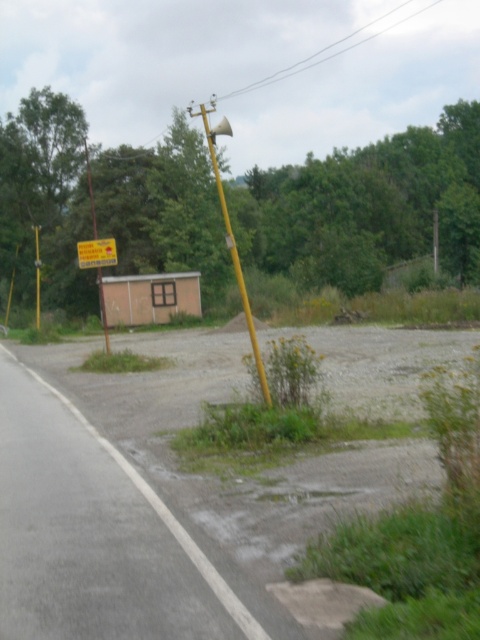
You are driving a car and see the yellow matte pole at center and the yellow plastic sign at center ahead on the road. Can you safely stop your car between them without hitting either? The car requires 40 meters to stop.

The distance between the yellow matte pole at center and the yellow plastic sign at center is 39.05 meters. Since the car needs 40 meters to stop, you cannot safely stop between them without hitting either object.

You are a delivery driver approaching the yellow matte pole at center and the yellow matte sign at left. You need to park your truck so that both objects are visible in your side mirrors. Which object should you position closer to your truck to ensure both are in view?

The yellow matte sign at left should be positioned closer to the truck because the yellow matte pole at center is taller than the yellow matte sign at left, so placing the shorter sign closer ensures both are within the side mirrors.

You are a driver approaching the yellow plastic sign at center and the yellow matte sign at left on a rural road. Which sign is located to the right when facing the direction of travel?

The yellow plastic sign at center is positioned on the right side of the yellow matte sign at left, so when facing the direction of travel, the yellow plastic sign at center would be on the right.